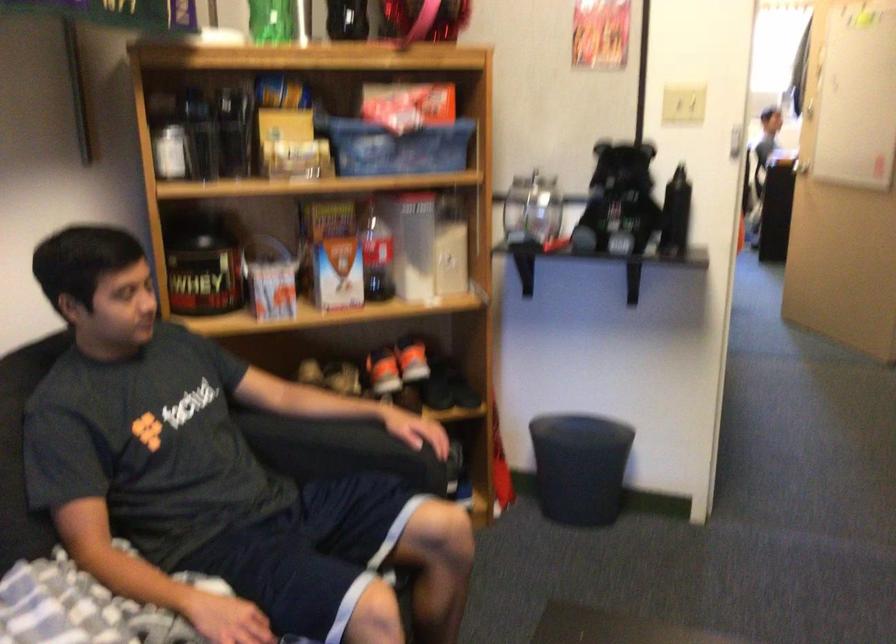
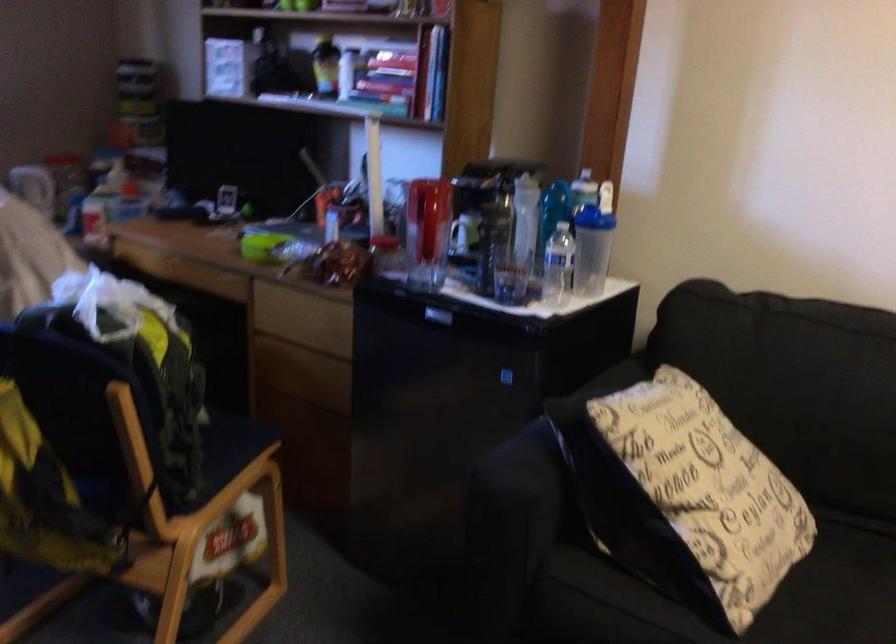
How did the camera likely rotate?

The camera's rotation is toward left-down.